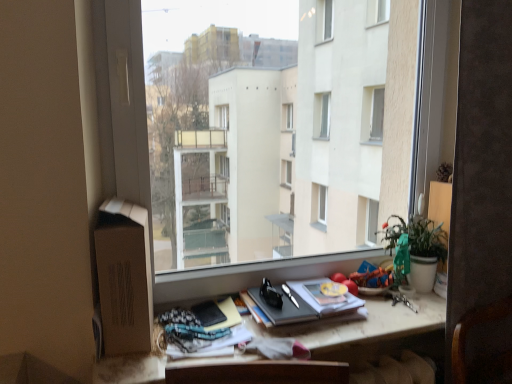
Question: From the image's perspective, is hardcover book at center, which is counted as the second paperback book, starting from the left, below matte black notebook at lower center, positioned as the second paperback book in right-to-left order?

Choices:
 (A) yes
 (B) no

Answer: (B)

Question: Can you confirm if hardcover book at center, which is counted as the second paperback book, starting from the left, is positioned to the right of matte black notebook at lower center, positioned as the second paperback book in right-to-left order?

Choices:
 (A) yes
 (B) no

Answer: (A)

Question: Does hardcover book at center, which is counted as the second paperback book, starting from the left, have a larger size compared to matte black notebook at lower center, positioned as the second paperback book in right-to-left order?

Choices:
 (A) no
 (B) yes

Answer: (B)

Question: Are hardcover book at center, which is counted as the second paperback book, starting from the left, and matte black notebook at lower center, the 1th paperback book in the left-to-right sequence, making contact?

Choices:
 (A) no
 (B) yes

Answer: (A)

Question: Is matte black notebook at lower center, positioned as the second paperback book in right-to-left order, completely or partially inside hardcover book at center, which is counted as the second paperback book, starting from the left?

Choices:
 (A) yes
 (B) no

Answer: (B)

Question: Does hardcover book at center, which is counted as the second paperback book, starting from the left, have a smaller size compared to matte black notebook at lower center, the 1th paperback book in the left-to-right sequence?

Choices:
 (A) yes
 (B) no

Answer: (B)

Question: Is matte wooden desk at center facing towards hardcover book at center, which is counted as the second paperback book, starting from the left?

Choices:
 (A) yes
 (B) no

Answer: (A)

Question: Does matte wooden desk at center appear on the right side of hardcover book at center, which is counted as the second paperback book, starting from the left?

Choices:
 (A) no
 (B) yes

Answer: (A)

Question: Can you confirm if matte wooden desk at center is wider than hardcover book at center, which ranks as the 1th paperback book in right-to-left order?

Choices:
 (A) yes
 (B) no

Answer: (A)

Question: Is matte wooden desk at center closer to the viewer compared to hardcover book at center, which is counted as the second paperback book, starting from the left?

Choices:
 (A) no
 (B) yes

Answer: (B)

Question: Would you say matte wooden desk at center is outside hardcover book at center, which ranks as the 1th paperback book in right-to-left order?

Choices:
 (A) no
 (B) yes

Answer: (B)

Question: From a real-world perspective, does matte wooden desk at center sit lower than hardcover book at center, which is counted as the second paperback book, starting from the left?

Choices:
 (A) yes
 (B) no

Answer: (A)

Question: Is the depth of green matte plant at right greater than that of hardcover book at center, which ranks as the 1th paperback book in right-to-left order?

Choices:
 (A) yes
 (B) no

Answer: (A)